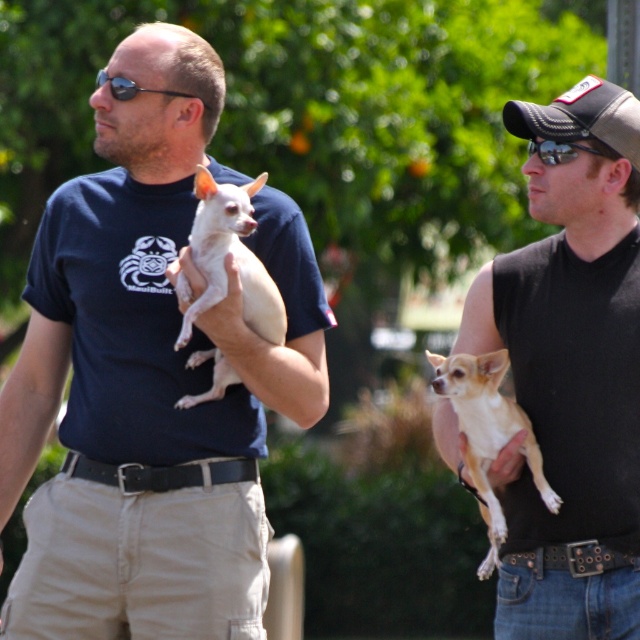
Question: Is black sleeveless shirt at center to the right of sunglasses/glass at right from the viewer's perspective?

Choices:
 (A) yes
 (B) no

Answer: (B)

Question: Among these points, which one is farthest from the camera?

Choices:
 (A) (236, 216)
 (B) (612, 131)
 (C) (518, 621)
 (D) (168, 262)

Answer: (D)

Question: Based on their relative distances, which object is farther from the matte black t-shirt at center?

Choices:
 (A) light beige fur at center
 (B) light brown fur at right

Answer: (B)

Question: Which of the following is the farthest from the observer?

Choices:
 (A) (193, 96)
 (B) (500, 426)
 (C) (544, 141)
 (D) (621, 637)

Answer: (A)

Question: Is light brown fur at right below black plastic sunglasses at upper left?

Choices:
 (A) yes
 (B) no

Answer: (A)

Question: Where is light beige fur at center located in relation to sunglasses/glass at right in the image?

Choices:
 (A) left
 (B) right

Answer: (A)